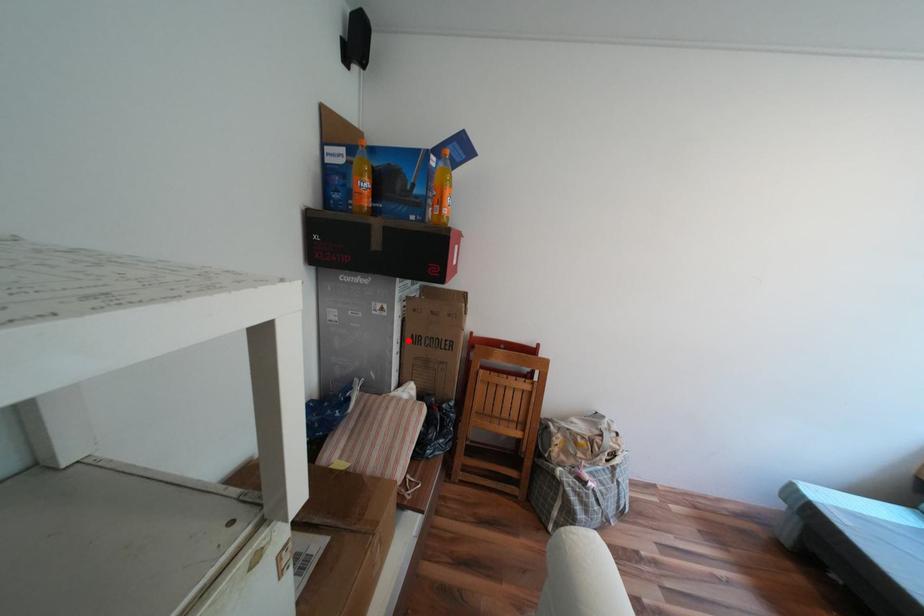
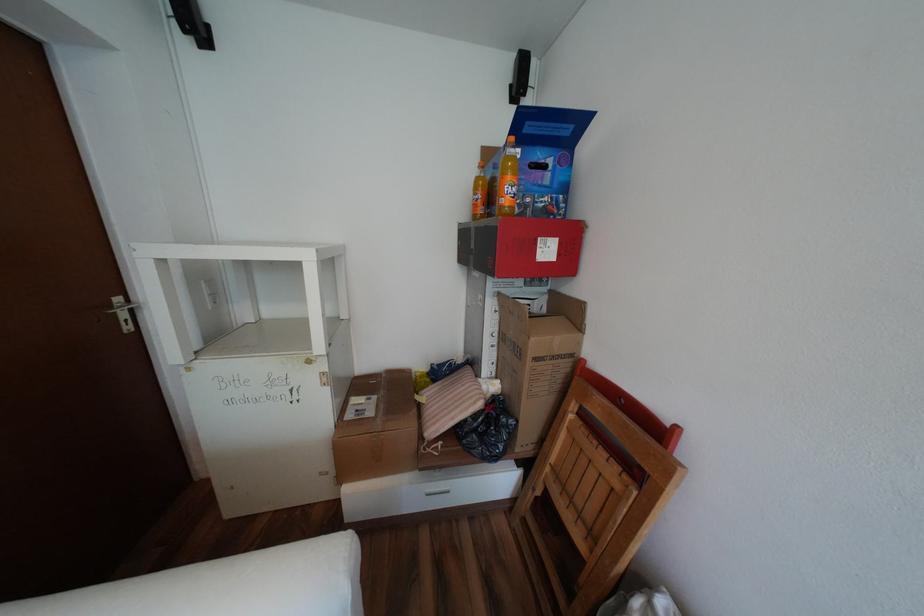
Locate, in the second image, the point that corresponds to the highlighted location in the first image.

(505, 334)